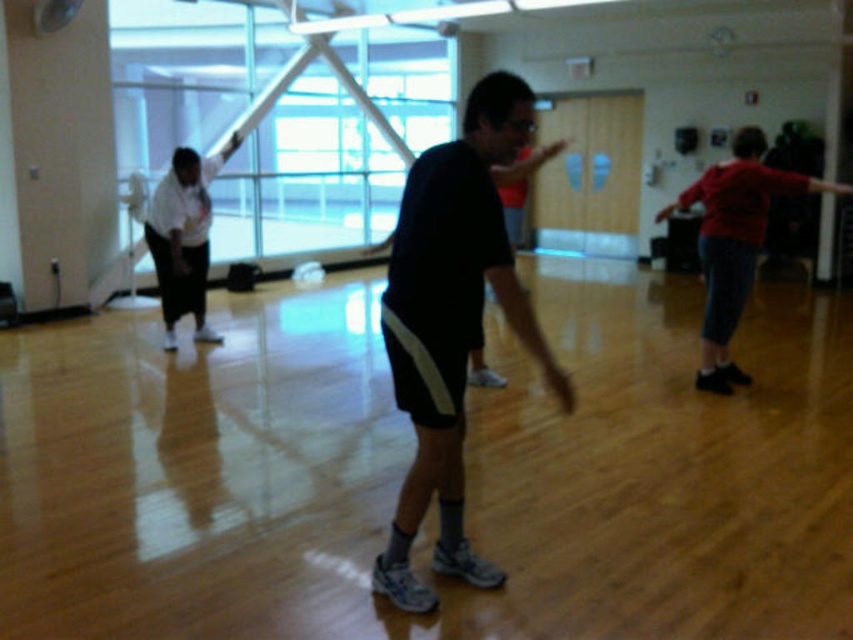
Question: Which object is closer to the camera taking this photo?

Choices:
 (A) dark blue jersey at center
 (B) white matte shirt at left

Answer: (A)

Question: Can you confirm if dark blue jersey at center is smaller than white matte shirt at left?

Choices:
 (A) no
 (B) yes

Answer: (B)

Question: Can you confirm if dark blue jersey at center is positioned to the right of white matte shirt at left?

Choices:
 (A) yes
 (B) no

Answer: (A)

Question: Is dark blue jersey at center below white matte shirt at left?

Choices:
 (A) yes
 (B) no

Answer: (A)

Question: Which point is farther to the camera?

Choices:
 (A) (496, 237)
 (B) (160, 260)

Answer: (B)

Question: Among these objects, which one is nearest to the camera?

Choices:
 (A) white matte shirt at left
 (B) dark blue jersey at center

Answer: (B)